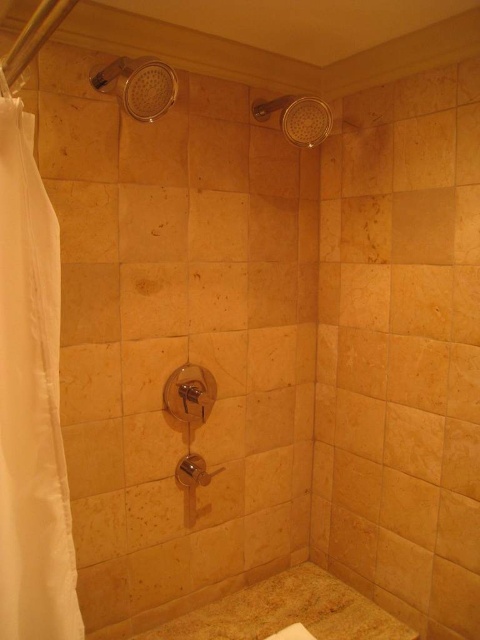
This screenshot has width=480, height=640. Describe the element at coordinates (31, 403) in the screenshot. I see `white fabric shower curtain at left` at that location.

Is white fabric shower curtain at left bigger than matte stone bathtub at lower center?

Indeed, white fabric shower curtain at left has a larger size compared to matte stone bathtub at lower center.

Which is behind, point (19, 616) or point (243, 637)?

Point (243, 637)

In order to click on white fabric shower curtain at left in this screenshot , I will do `click(31, 403)`.

Can you confirm if white fabric shower curtain at left is positioned to the right of clear plastic showerhead at upper center?

In fact, white fabric shower curtain at left is to the left of clear plastic showerhead at upper center.

Does white fabric shower curtain at left have a greater height compared to clear plastic showerhead at upper center?

Correct, white fabric shower curtain at left is much taller as clear plastic showerhead at upper center.

Which is in front, point (26, 512) or point (311, 134)?

Point (26, 512) is in front.

Find the location of a particular element. The height and width of the screenshot is (640, 480). white fabric shower curtain at left is located at coordinates (31, 403).

Measure the distance between point (168, 70) and camera.

The distance of point (168, 70) from camera is 1.28 meters.

Identify the location of matte silver showerhead at upper left. (140, 84).

Who is more distant from viewer, (x=164, y=109) or (x=291, y=120)?

Point (x=291, y=120)

This screenshot has height=640, width=480. In order to click on matte silver showerhead at upper left in this screenshot , I will do `click(140, 84)`.